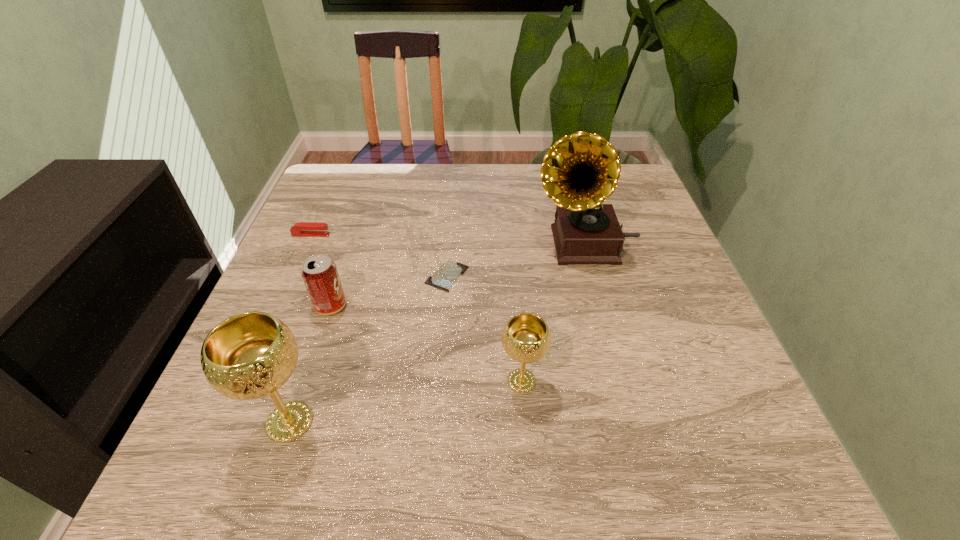
Image resolution: width=960 pixels, height=540 pixels. What are the coordinates of `the fifth tallest object` in the screenshot? It's located at (302, 229).

Locate an element on the screen. The width and height of the screenshot is (960, 540). free space located on the back of the left chalice is located at coordinates (340, 271).

The image size is (960, 540). In order to click on vacant space located 0.230m on the back of the fourth shortest object in this screenshot , I will do `click(514, 278)`.

Find the location of a particular element. This screenshot has height=540, width=960. vacant space located from the horn of the rightmost object is located at coordinates (488, 244).

Where is `vacant area situated from the horn of the rightmost object`? Image resolution: width=960 pixels, height=540 pixels. vacant area situated from the horn of the rightmost object is located at coordinates (454, 244).

You are a GUI agent. You are given a task and a screenshot of the screen. Output one action in this format:
    pyautogui.click(x=<x>, y=<y>)
    Task: Click on the free space located from the horn of the rightmost object
    
    Given the screenshot: What is the action you would take?
    point(508,244)

You are a GUI agent. You are given a task and a screenshot of the screen. Output one action in this format:
    pyautogui.click(x=<x>, y=<y>)
    Task: Click on the blank area located on the back of the fourth farthest object
    
    Given the screenshot: What is the action you would take?
    pyautogui.click(x=368, y=194)

Identify the location of free space located on the left of the fourth object from left to right. pos(381,276).

Find the location of a particular element. vacant space situated 0.090m on the front-facing side of the fifth tallest object is located at coordinates (366, 235).

The height and width of the screenshot is (540, 960). Find the location of `chalice located in the left edge section of the desktop`. chalice located in the left edge section of the desktop is located at coordinates (250, 355).